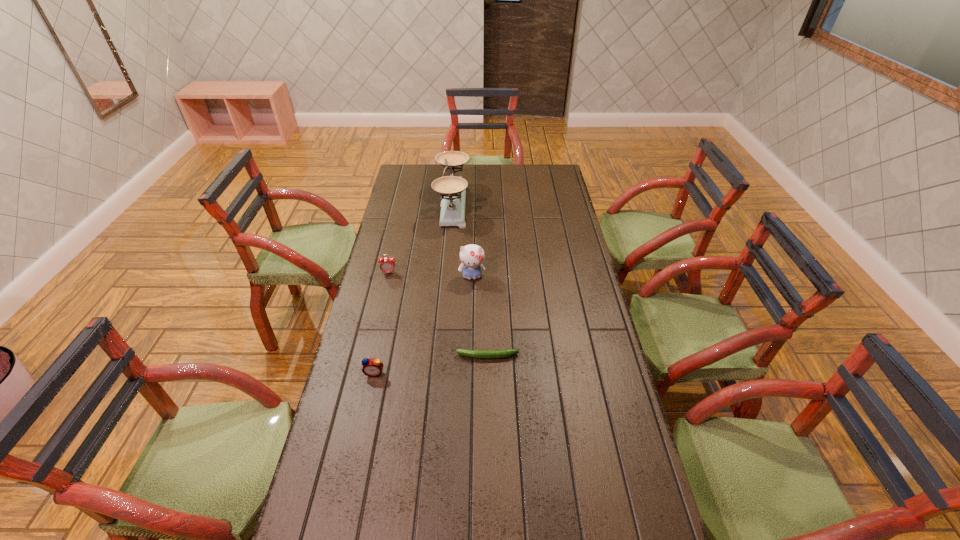
At what (x,y) coordinates should I click in order to perform the action: click on empty space between the farther alarm clock and the kitten. Please return your answer as a coordinate pair (x, y). This screenshot has height=540, width=960. Looking at the image, I should click on (430, 275).

Where is `free space between the kitten and the fourth farthest object`? The width and height of the screenshot is (960, 540). free space between the kitten and the fourth farthest object is located at coordinates (480, 316).

At what (x,y) coordinates should I click in order to perform the action: click on vacant point located between the nearer alarm clock and the zucchini. Please return your answer as a coordinate pair (x, y). Image resolution: width=960 pixels, height=540 pixels. Looking at the image, I should click on (431, 364).

This screenshot has height=540, width=960. I want to click on free space between the nearest object and the farther alarm clock, so click(x=382, y=323).

You are a GUI agent. You are given a task and a screenshot of the screen. Output one action in this format:
    pyautogui.click(x=<x>, y=<y>)
    Task: Click on the vacant space in between the farthest object and the nearer alarm clock
    This screenshot has height=540, width=960.
    Given the screenshot: What is the action you would take?
    pyautogui.click(x=414, y=289)

I want to click on vacant space in between the shortest object and the fourth shortest object, so click(480, 316).

The width and height of the screenshot is (960, 540). In order to click on empty space that is in between the fourth shortest object and the zucchini in this screenshot , I will do `click(480, 316)`.

What are the coordinates of `vacant space that's between the nearer alarm clock and the farther alarm clock` in the screenshot? It's located at (382, 323).

Where is `the second closest object to the farther alarm clock`? This screenshot has height=540, width=960. the second closest object to the farther alarm clock is located at coordinates (452, 189).

Where is `the closest object relative to the farther alarm clock`? The image size is (960, 540). the closest object relative to the farther alarm clock is located at coordinates (471, 256).